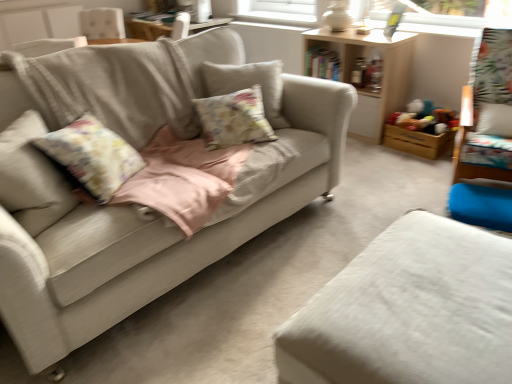
Locate an element on the screen. light beige fabric couch at center, the 1th studio couch viewed from the left is located at coordinates (144, 230).

Locate an element on the screen. This screenshot has width=512, height=384. wooden shelf at upper center is located at coordinates (382, 72).

Locate an element on the screen. The image size is (512, 384). wooden swivel chair at right is located at coordinates (487, 112).

This screenshot has height=384, width=512. In order to click on white fabric ottoman at lower right, the 2th studio couch in the left-to-right sequence in this screenshot , I will do `click(409, 311)`.

Which object is more forward, wooden toy box at right or fluffy fabric pillow at center?

Positioned in front is fluffy fabric pillow at center.

Is wooden toy box at right oriented towards fluffy fabric pillow at center?

No.

Would you say wooden toy box at right is inside or outside fluffy fabric pillow at center?

wooden toy box at right is not enclosed by fluffy fabric pillow at center.

Is fluffy fabric pillow at center smaller than light beige fabric couch at center, the second studio couch from the right?

Indeed, fluffy fabric pillow at center has a smaller size compared to light beige fabric couch at center, the second studio couch from the right.

I want to click on pillow above the light beige fabric couch at center, the second studio couch from the right (from the image's perspective), so click(x=234, y=119).

Considering the relative sizes of fluffy fabric pillow at center and light beige fabric couch at center, the 1th studio couch viewed from the left, in the image provided, is fluffy fabric pillow at center thinner than light beige fabric couch at center, the 1th studio couch viewed from the left,?

Yes.

From a real-world perspective, is fluffy fabric pillow at center on light beige fabric couch at center, the 1th studio couch viewed from the left?

Yes, from a real-world perspective, fluffy fabric pillow at center is above light beige fabric couch at center, the 1th studio couch viewed from the left.

From the image's perspective, would you say light beige fabric couch at center, the 1th studio couch viewed from the left, is positioned over white fabric ottoman at lower right, positioned as the first studio couch in right-to-left order?

Yes, from the image's perspective, light beige fabric couch at center, the 1th studio couch viewed from the left, is over white fabric ottoman at lower right, positioned as the first studio couch in right-to-left order.

Is light beige fabric couch at center, the second studio couch from the right, not close to white fabric ottoman at lower right, positioned as the first studio couch in right-to-left order?

light beige fabric couch at center, the second studio couch from the right, is actually quite close to white fabric ottoman at lower right, positioned as the first studio couch in right-to-left order.

Which object is positioned more to the right, light beige fabric couch at center, the 1th studio couch viewed from the left, or white fabric ottoman at lower right, the 2th studio couch in the left-to-right sequence?

Positioned to the right is white fabric ottoman at lower right, the 2th studio couch in the left-to-right sequence.

In the scene shown: Is light beige fabric couch at center, the second studio couch from the right, inside the boundaries of fluffy fabric pillow at center, or outside?

light beige fabric couch at center, the second studio couch from the right, exists outside the volume of fluffy fabric pillow at center.

Where is `pillow positioned vertically above the light beige fabric couch at center, the 1th studio couch viewed from the left (from a real-world perspective)`? pillow positioned vertically above the light beige fabric couch at center, the 1th studio couch viewed from the left (from a real-world perspective) is located at coordinates (234, 119).

Is light beige fabric couch at center, the 1th studio couch viewed from the left, taller or shorter than fluffy fabric pillow at center?

Clearly, light beige fabric couch at center, the 1th studio couch viewed from the left, is taller compared to fluffy fabric pillow at center.

Can you tell me how much light beige fabric couch at center, the second studio couch from the right, and fluffy fabric pillow at center differ in facing direction?

The angular difference between light beige fabric couch at center, the second studio couch from the right, and fluffy fabric pillow at center is 31.9 degrees.

Does wooden swivel chair at right have a greater width compared to fluffy fabric pillow at center?

Indeed, wooden swivel chair at right has a greater width compared to fluffy fabric pillow at center.

How different are the orientations of wooden swivel chair at right and fluffy fabric pillow at center in degrees?

The facing directions of wooden swivel chair at right and fluffy fabric pillow at center are 36.8 degrees apart.

Considering the sizes of objects wooden swivel chair at right and fluffy fabric pillow at center in the image provided, who is bigger, wooden swivel chair at right or fluffy fabric pillow at center?

wooden swivel chair at right is bigger.

Considering the relative positions of wooden swivel chair at right and fluffy fabric pillow at center in the image provided, is wooden swivel chair at right to the right of fluffy fabric pillow at center from the viewer's perspective?

Correct, you'll find wooden swivel chair at right to the right of fluffy fabric pillow at center.

Is wooden shelf at upper center smaller than white fabric ottoman at lower right, positioned as the first studio couch in right-to-left order?

No.

Is the surface of wooden shelf at upper center in direct contact with white fabric ottoman at lower right, positioned as the first studio couch in right-to-left order?

There is a gap between wooden shelf at upper center and white fabric ottoman at lower right, positioned as the first studio couch in right-to-left order.

Considering the sizes of objects wooden shelf at upper center and white fabric ottoman at lower right, the 2th studio couch in the left-to-right sequence, in the image provided, who is wider, wooden shelf at upper center or white fabric ottoman at lower right, the 2th studio couch in the left-to-right sequence,?

white fabric ottoman at lower right, the 2th studio couch in the left-to-right sequence.

Does fluffy fabric pillow at center come behind wooden shelf at upper center?

No, it is in front of wooden shelf at upper center.

How different are the orientations of fluffy fabric pillow at center and wooden shelf at upper center in degrees?

fluffy fabric pillow at center and wooden shelf at upper center are facing 56.7 degrees away from each other.

From the image's perspective, which one is positioned higher, fluffy fabric pillow at center or wooden shelf at upper center?

wooden shelf at upper center.

Is wooden shelf at upper center located within fluffy fabric pillow at center?

Actually, wooden shelf at upper center is outside fluffy fabric pillow at center.

This screenshot has height=384, width=512. I want to click on pillow that is above the wooden toy box at right (from a real-world perspective), so click(x=234, y=119).

Where is `studio couch that is the 1st one when counting downward from the fluffy fabric pillow at center (from the image's perspective)`? studio couch that is the 1st one when counting downward from the fluffy fabric pillow at center (from the image's perspective) is located at coordinates (144, 230).

Based on their spatial positions, is white fabric ottoman at lower right, positioned as the first studio couch in right-to-left order, or wooden swivel chair at right closer to fluffy fabric pillow at center?

Among the two, white fabric ottoman at lower right, positioned as the first studio couch in right-to-left order, is located nearer to fluffy fabric pillow at center.

Considering their positions, is wooden toy box at right positioned closer to white fabric ottoman at lower right, the 2th studio couch in the left-to-right sequence, than fluffy fabric pillow at center?

fluffy fabric pillow at center is closer to white fabric ottoman at lower right, the 2th studio couch in the left-to-right sequence.

Based on their spatial positions, is light beige fabric couch at center, the 1th studio couch viewed from the left, or wooden swivel chair at right closer to wooden toy box at right?

wooden swivel chair at right lies closer to wooden toy box at right than the other object.

Looking at the image, which one is located further to wooden swivel chair at right, wooden shelf at upper center or white fabric ottoman at lower right, the 2th studio couch in the left-to-right sequence?

white fabric ottoman at lower right, the 2th studio couch in the left-to-right sequence, lies further to wooden swivel chair at right than the other object.

Estimate the real-world distances between objects in this image. Which object is closer to white fabric ottoman at lower right, the 2th studio couch in the left-to-right sequence, wooden shelf at upper center or wooden toy box at right?

wooden toy box at right lies closer to white fabric ottoman at lower right, the 2th studio couch in the left-to-right sequence, than the other object.

Estimate the real-world distances between objects in this image. Which object is further from wooden toy box at right, white fabric ottoman at lower right, the 2th studio couch in the left-to-right sequence, or fluffy fabric pillow at center?

Among the two, white fabric ottoman at lower right, the 2th studio couch in the left-to-right sequence, is located further to wooden toy box at right.

Based on their spatial positions, is wooden shelf at upper center or white fabric ottoman at lower right, the 2th studio couch in the left-to-right sequence, further from fluffy fabric pillow at center?

Based on the image, wooden shelf at upper center appears to be further to fluffy fabric pillow at center.

Which object lies further to the anchor point light beige fabric couch at center, the second studio couch from the right, fluffy fabric pillow at center or wooden toy box at right?

wooden toy box at right is positioned further to the anchor light beige fabric couch at center, the second studio couch from the right.

I want to click on swivel chair positioned between white fabric ottoman at lower right, positioned as the first studio couch in right-to-left order, and wooden toy box at right from near to far, so click(x=487, y=112).

At what (x,y) coordinates should I click in order to perform the action: click on table between fluffy fabric pillow at center and wooden swivel chair at right from left to right. Please return your answer as a coordinate pair (x, y). Looking at the image, I should click on (382, 72).

In order to click on studio couch between white fabric ottoman at lower right, the 2th studio couch in the left-to-right sequence, and wooden shelf at upper center, along the z-axis in this screenshot , I will do `click(144, 230)`.

This screenshot has height=384, width=512. In order to click on swivel chair positioned between light beige fabric couch at center, the 1th studio couch viewed from the left, and wooden shelf at upper center from near to far in this screenshot , I will do `click(487, 112)`.